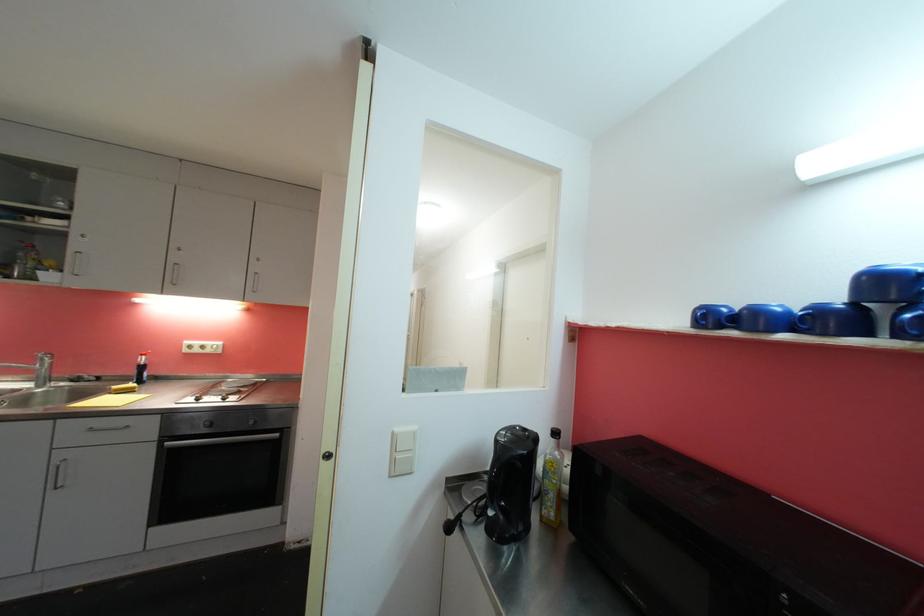
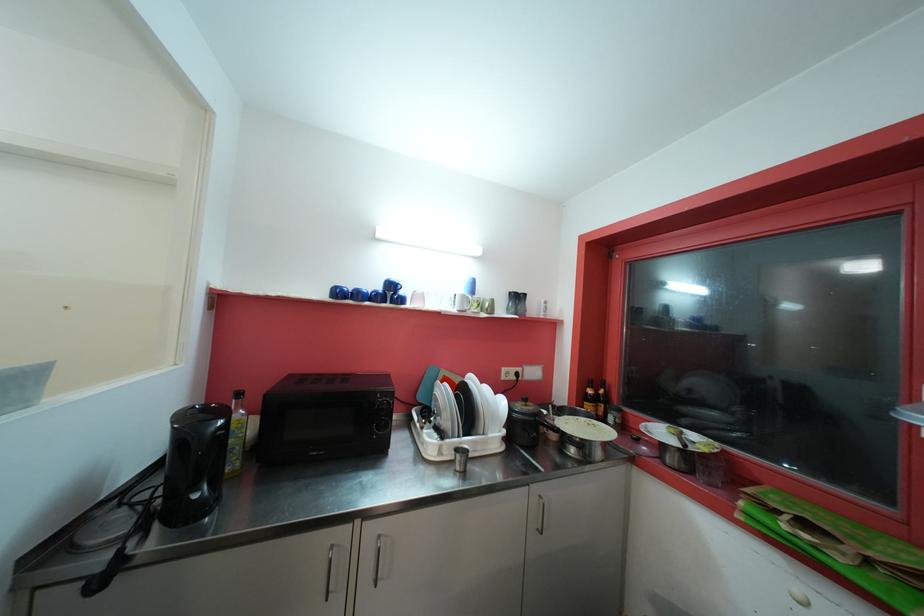
Locate, in the second image, the point that corresponds to [500,512] in the first image.

(203, 492)